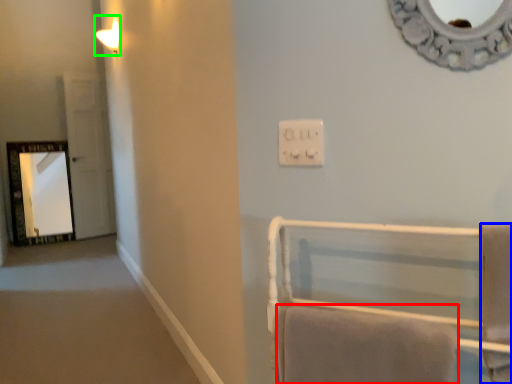
Question: Which object is the closest to the bath towel (highlighted by a red box)? Choose among these: bath towel (highlighted by a blue box) or light fixture (highlighted by a green box).

Choices:
 (A) bath towel
 (B) light fixture

Answer: (A)